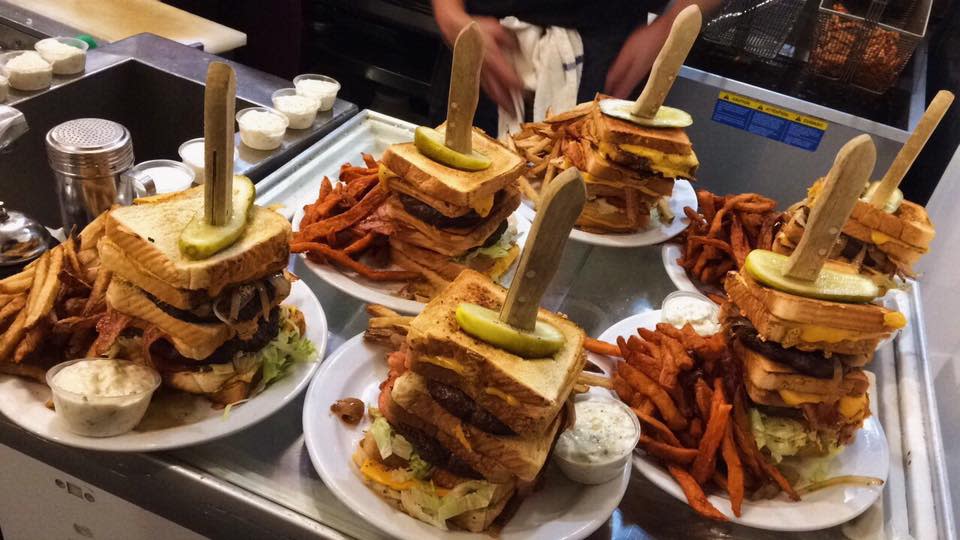
Identify the location of white plate. The height and width of the screenshot is (540, 960). click(x=813, y=511).